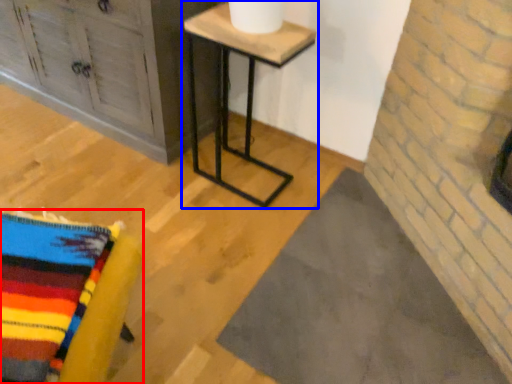
Question: Which object appears closest to the camera in this image, furniture (highlighted by a red box) or table (highlighted by a blue box)?

Choices:
 (A) furniture
 (B) table

Answer: (A)